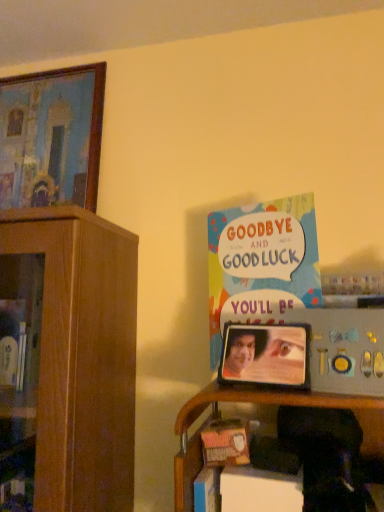
Question: In which direction should I rotate to look at metallic silver picture frame at center, the first picture frame from the front?

Choices:
 (A) right
 (B) left

Answer: (A)

Question: Does multicolored paper card at upper right have a greater width compared to wooden shelf at lower right?

Choices:
 (A) no
 (B) yes

Answer: (A)

Question: Is multicolored paper card at upper right positioned with its back to wooden shelf at lower right?

Choices:
 (A) yes
 (B) no

Answer: (B)

Question: Considering the relative sizes of multicolored paper card at upper right and wooden shelf at lower right in the image provided, is multicolored paper card at upper right thinner than wooden shelf at lower right?

Choices:
 (A) no
 (B) yes

Answer: (B)

Question: Is multicolored paper card at upper right oriented towards wooden shelf at lower right?

Choices:
 (A) yes
 (B) no

Answer: (B)

Question: Is multicolored paper card at upper right outside of wooden shelf at lower right?

Choices:
 (A) yes
 (B) no

Answer: (A)

Question: From the image's perspective, is multicolored paper card at upper right below wooden shelf at lower right?

Choices:
 (A) no
 (B) yes

Answer: (A)

Question: Is the position of wooden shelf at lower right more distant than that of wooden painted picture frame at upper left, which is counted as the first picture frame, starting from the left?

Choices:
 (A) yes
 (B) no

Answer: (B)

Question: Is wooden shelf at lower right bigger than wooden painted picture frame at upper left, which ranks as the 1th picture frame in back-to-front order?

Choices:
 (A) no
 (B) yes

Answer: (B)

Question: From the image's perspective, is wooden shelf at lower right located above wooden painted picture frame at upper left, which is counted as the first picture frame, starting from the left?

Choices:
 (A) no
 (B) yes

Answer: (A)

Question: Is wooden shelf at lower right not close to wooden painted picture frame at upper left, the second picture frame in the front-to-back sequence?

Choices:
 (A) no
 (B) yes

Answer: (A)

Question: Does wooden shelf at lower right have a lesser height compared to wooden painted picture frame at upper left, which is counted as the first picture frame, starting from the left?

Choices:
 (A) yes
 (B) no

Answer: (A)

Question: Does wooden shelf at lower right appear on the left side of wooden painted picture frame at upper left, which is counted as the first picture frame, starting from the left?

Choices:
 (A) yes
 (B) no

Answer: (B)

Question: Could multicolored paper card at upper right be considered to be inside wooden shelf at lower right?

Choices:
 (A) no
 (B) yes

Answer: (A)